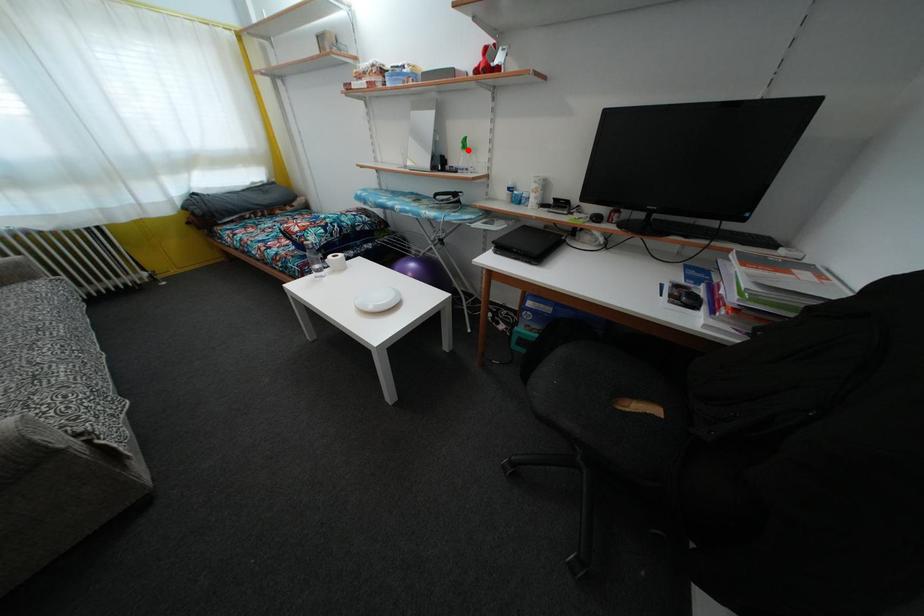
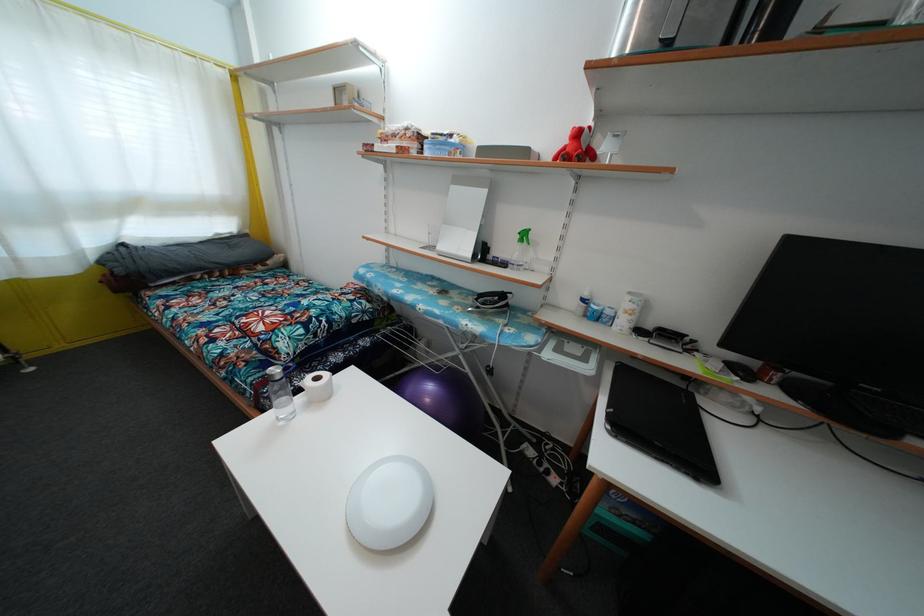
Question: I am providing you with two images of the same scene from different viewpoints. Image1 has a red point marked. In image2, the corresponding 3D location appears at what relative position? Reply with the corresponding letter.

Choices:
 (A) Closer
 (B) Farther

Answer: (B)